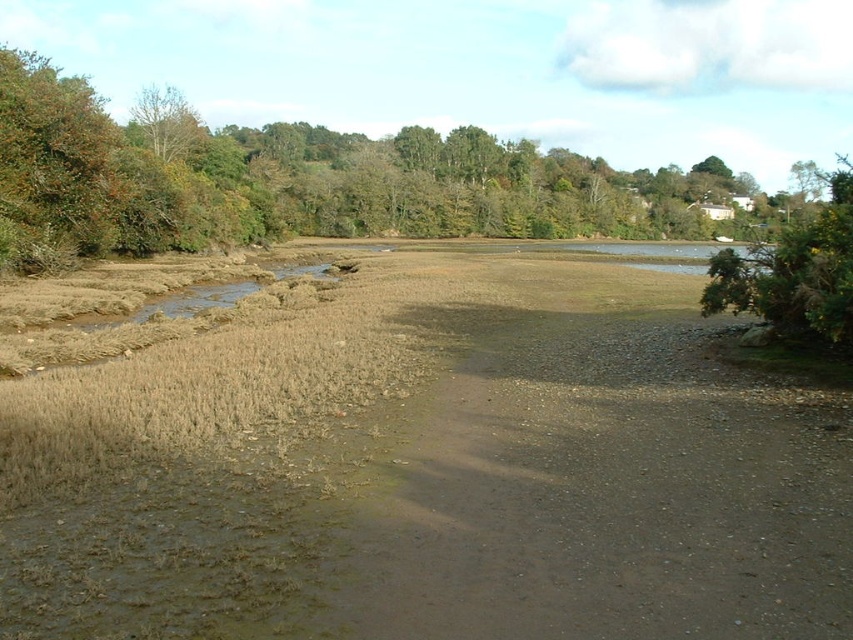
Which of these two, brown dirt track at center or green leafy bush at right, stands taller?

With more height is green leafy bush at right.

This screenshot has height=640, width=853. Describe the element at coordinates (428, 472) in the screenshot. I see `brown dirt track at center` at that location.

Between point (672, 368) and point (825, 328), which one is positioned behind?

Point (672, 368)

At what (x,y) coordinates should I click in order to perform the action: click on brown dirt track at center. Please return your answer as a coordinate pair (x, y). The width and height of the screenshot is (853, 640). Looking at the image, I should click on (428, 472).

How distant is brown dirt track at center from green leafy tree at upper left?

brown dirt track at center and green leafy tree at upper left are 74.15 meters apart from each other.

Is brown dirt track at center taller than green leafy tree at upper left?

No, brown dirt track at center is not taller than green leafy tree at upper left.

Between point (730, 568) and point (42, 145), which one is positioned behind?

Positioned behind is point (42, 145).

Locate an element on the screen. This screenshot has width=853, height=640. brown dirt track at center is located at coordinates (428, 472).

Between green leafy tree at upper left and green leafy bush at right, which one appears on the right side from the viewer's perspective?

From the viewer's perspective, green leafy bush at right appears more on the right side.

Does green leafy tree at upper left lie in front of green leafy bush at right?

No, it is behind green leafy bush at right.

Is point (463, 193) less distant than point (840, 296)?

No, it is behind (840, 296).

The height and width of the screenshot is (640, 853). I want to click on green leafy tree at upper left, so click(294, 180).